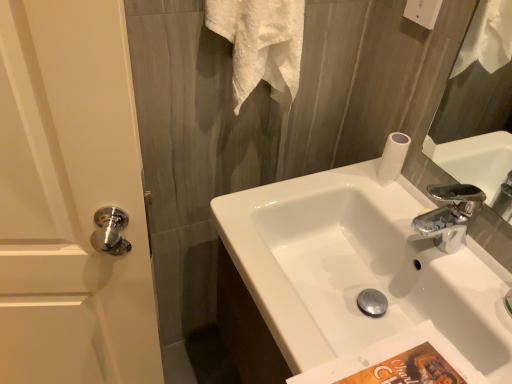
Question: Is white glossy door handle at left beside white glossy sink at center?

Choices:
 (A) yes
 (B) no

Answer: (B)

Question: Does white glossy door handle at left appear on the left side of white glossy sink at center?

Choices:
 (A) no
 (B) yes

Answer: (B)

Question: Does white glossy door handle at left appear on the right side of white glossy sink at center?

Choices:
 (A) yes
 (B) no

Answer: (B)

Question: Does white glossy door handle at left have a lesser height compared to white glossy sink at center?

Choices:
 (A) no
 (B) yes

Answer: (A)

Question: From the image's perspective, is white glossy door handle at left over white glossy sink at center?

Choices:
 (A) yes
 (B) no

Answer: (B)

Question: Would you say white glossy sink at center is to the left or to the right of white glossy door handle at left in the picture?

Choices:
 (A) right
 (B) left

Answer: (A)

Question: Is white glossy sink at center taller or shorter than white glossy door handle at left?

Choices:
 (A) tall
 (B) short

Answer: (B)

Question: From a real-world perspective, is white glossy sink at center physically located above or below white glossy door handle at left?

Choices:
 (A) above
 (B) below

Answer: (A)

Question: Do you think white glossy sink at center is within white glossy door handle at left, or outside of it?

Choices:
 (A) outside
 (B) inside

Answer: (A)

Question: From a real-world perspective, is white glossy sink at center positioned above or below white textured towel at upper center?

Choices:
 (A) above
 (B) below

Answer: (B)

Question: Considering the positions of point (398, 294) and point (256, 13), is point (398, 294) closer or farther from the camera than point (256, 13)?

Choices:
 (A) closer
 (B) farther

Answer: (B)

Question: From the image's perspective, relative to white textured towel at upper center, is white glossy sink at center above or below?

Choices:
 (A) above
 (B) below

Answer: (B)

Question: In the image, is white glossy sink at center positioned in front of or behind white textured towel at upper center?

Choices:
 (A) front
 (B) behind

Answer: (A)

Question: In the image, is white textured towel at upper center on the left side or the right side of white glossy door handle at left?

Choices:
 (A) left
 (B) right

Answer: (B)

Question: Does point (284, 39) appear closer or farther from the camera than point (140, 336)?

Choices:
 (A) closer
 (B) farther

Answer: (A)